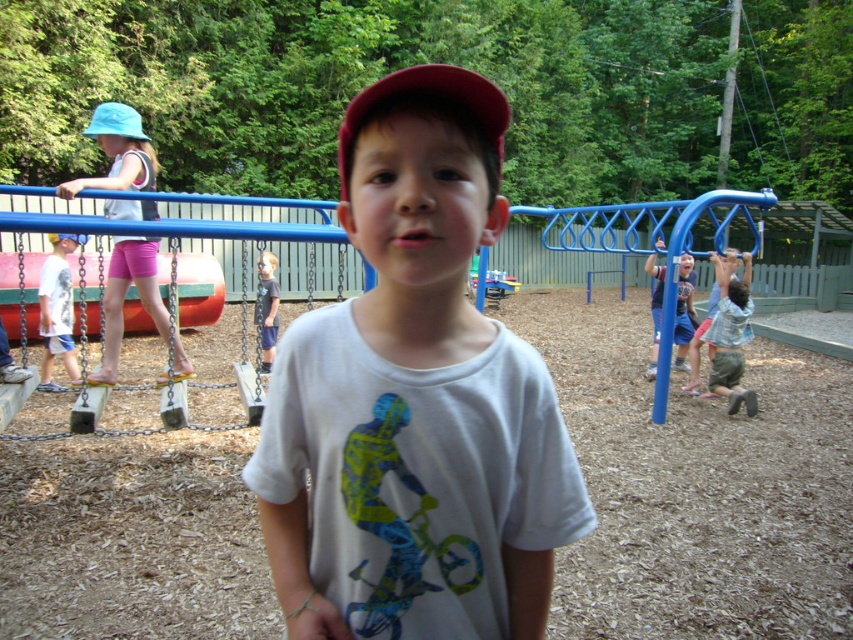
Between white cotton shirt at left and blue fabric baseball hat at upper left, which one has more height?

blue fabric baseball hat at upper left

Can you confirm if white cotton shirt at left is smaller than blue fabric baseball hat at upper left?

Correct, white cotton shirt at left occupies less space than blue fabric baseball hat at upper left.

What do you see at coordinates (57, 310) in the screenshot? The width and height of the screenshot is (853, 640). I see `white cotton shirt at left` at bounding box center [57, 310].

At what (x,y) coordinates should I click in order to perform the action: click on white cotton shirt at left. Please return your answer as a coordinate pair (x, y). This screenshot has height=640, width=853. Looking at the image, I should click on (57, 310).

What do you see at coordinates (427, 93) in the screenshot?
I see `red matte baseball cap at center` at bounding box center [427, 93].

Does red matte baseball cap at center have a lesser height compared to dark blue shirt at center?

No, red matte baseball cap at center is not shorter than dark blue shirt at center.

What do you see at coordinates (427, 93) in the screenshot? The width and height of the screenshot is (853, 640). I see `red matte baseball cap at center` at bounding box center [427, 93].

Locate an element on the screen. The width and height of the screenshot is (853, 640). red matte baseball cap at center is located at coordinates (427, 93).

Is light blue plaid shirt at right to the left of white cotton shirt at left from the viewer's perspective?

Incorrect, light blue plaid shirt at right is not on the left side of white cotton shirt at left.

Which is below, light blue plaid shirt at right or white cotton shirt at left?

light blue plaid shirt at right is below.

Between point (741, 353) and point (44, 296), which one is positioned behind?

Positioned behind is point (741, 353).

Locate an element on the screen. Image resolution: width=853 pixels, height=640 pixels. light blue plaid shirt at right is located at coordinates (730, 333).